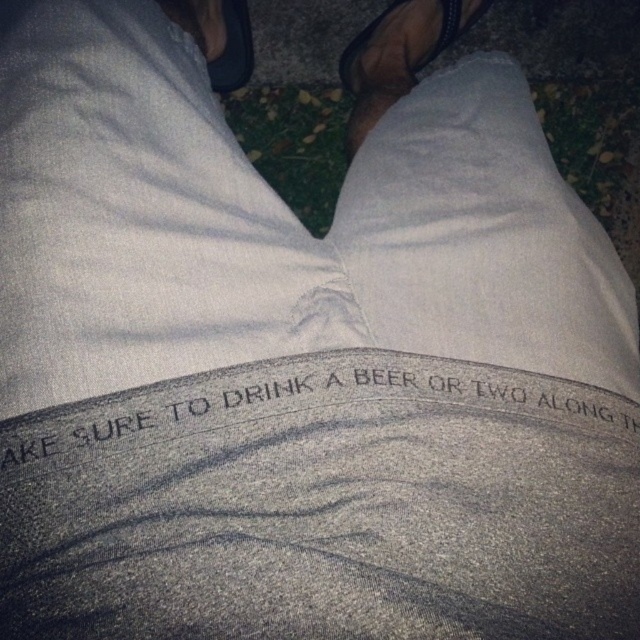
Question: Can you confirm if black textured text at center is wider than black leather sandal at upper center?

Choices:
 (A) no
 (B) yes

Answer: (B)

Question: Does black textured text at center have a lesser width compared to black leather sandal at upper center?

Choices:
 (A) no
 (B) yes

Answer: (A)

Question: From the image, what is the correct spatial relationship of black textured text at center in relation to black leather sandal at upper center?

Choices:
 (A) left
 (B) right

Answer: (A)